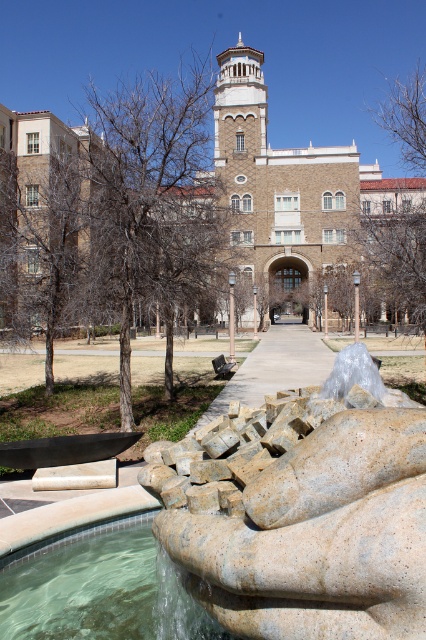
Question: Considering the real-world distances, which object is farthest from the bare wood tree at left?

Choices:
 (A) bare branches at upper right
 (B) brown textured tree at center
 (C) clear stone fountain at lower left

Answer: (A)

Question: From the image, what is the correct spatial relationship of clear stone fountain at lower left in relation to bare branches at upper right?

Choices:
 (A) left
 (B) right

Answer: (A)

Question: Which point is closer to the camera taking this photo?

Choices:
 (A) (42, 216)
 (B) (417, 173)
 (C) (173, 80)
 (D) (368, 252)

Answer: (A)

Question: Is bare wood tree at left closer to the viewer compared to brown textured tree at center?

Choices:
 (A) yes
 (B) no

Answer: (A)

Question: Estimate the real-world distances between objects in this image. Which object is closer to the brown textured tree at center?

Choices:
 (A) granite fountain at lower center
 (B) clear stone fountain at lower left

Answer: (A)

Question: Is granite fountain at lower center positioned before brown leafless tree at center?

Choices:
 (A) yes
 (B) no

Answer: (A)